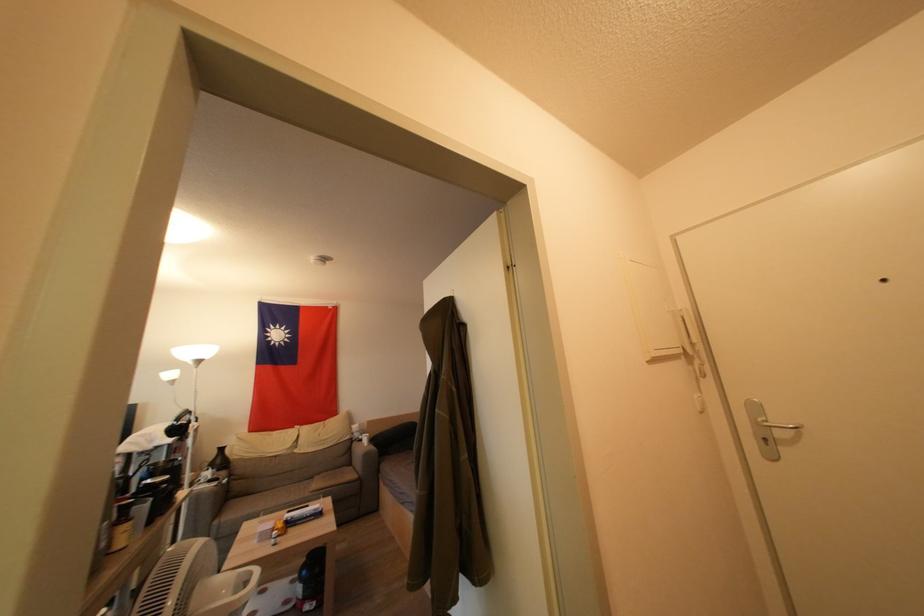
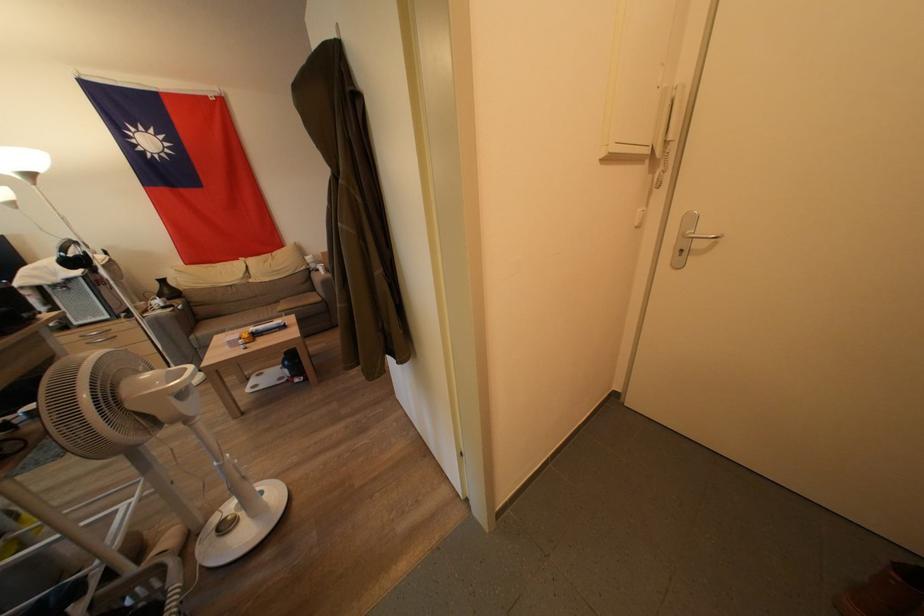
In the second image, find the point that corresponds to (x=224, y=464) in the first image.

(172, 296)